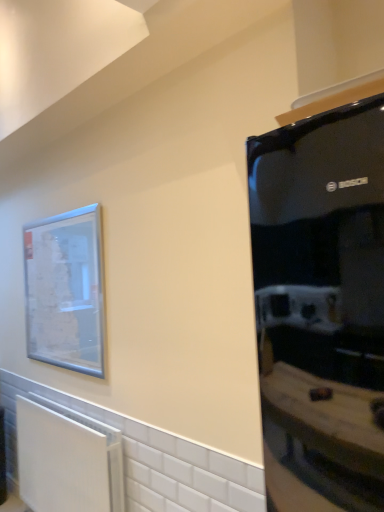
Question: Looking at the image, does white matte radiator at lower left seem bigger or smaller compared to clear glass picture frame at upper left?

Choices:
 (A) small
 (B) big

Answer: (B)

Question: From a real-world perspective, is white matte radiator at lower left physically located above or below clear glass picture frame at upper left?

Choices:
 (A) above
 (B) below

Answer: (B)

Question: Which of these objects is positioned farthest from the black glossy refrigerator at right?

Choices:
 (A) clear glass picture frame at upper left
 (B) white matte radiator at lower left

Answer: (B)

Question: Which object is positioned farthest from the clear glass picture frame at upper left?

Choices:
 (A) white matte radiator at lower left
 (B) black glossy refrigerator at right

Answer: (B)